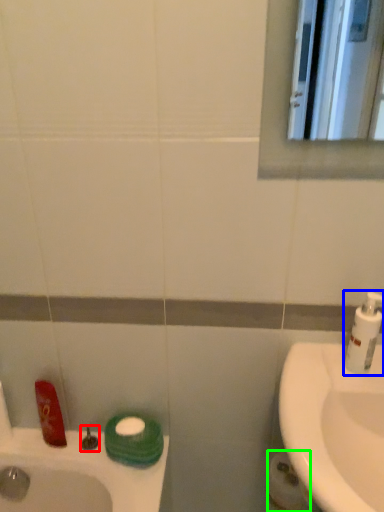
Question: Estimate the real-world distances between objects in this image. Which object is farther from plumbing fixture (highlighted by a red box), soap dispenser (highlighted by a blue box) or toilet paper (highlighted by a green box)?

Choices:
 (A) soap dispenser
 (B) toilet paper

Answer: (A)